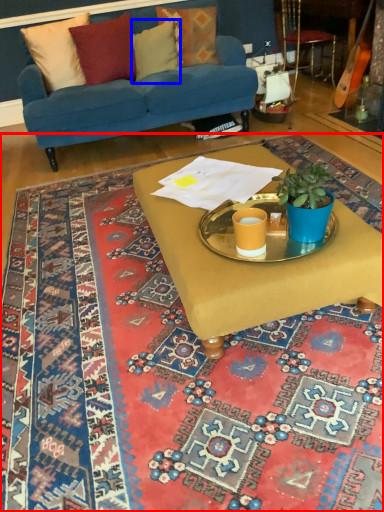
Question: Among these objects, which one is nearest to the camera, mat (highlighted by a red box) or pillow (highlighted by a blue box)?

Choices:
 (A) mat
 (B) pillow

Answer: (A)